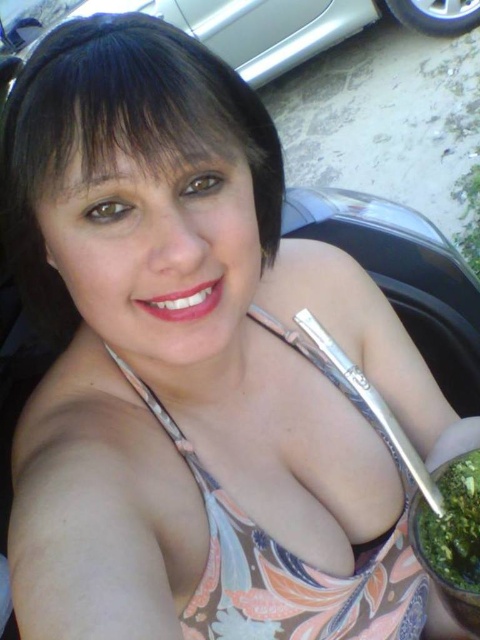
Question: Does floral print bikini top at center come in front of silver metallic car at upper center?

Choices:
 (A) yes
 (B) no

Answer: (A)

Question: Among these points, which one is nearest to the camera?

Choices:
 (A) (409, 518)
 (B) (276, 612)

Answer: (A)

Question: Is floral print bikini top at center closer to camera compared to silver metallic car at upper center?

Choices:
 (A) no
 (B) yes

Answer: (B)

Question: Which object appears farthest from the camera in this image?

Choices:
 (A) green leafy substance at lower right
 (B) floral print bikini top at center
 (C) silver metallic car at upper center

Answer: (C)

Question: Does floral print bikini top at center have a lesser width compared to green leafy substance at lower right?

Choices:
 (A) no
 (B) yes

Answer: (A)

Question: Among these objects, which one is farthest from the camera?

Choices:
 (A) silver metallic car at upper center
 (B) green leafy substance at lower right

Answer: (A)